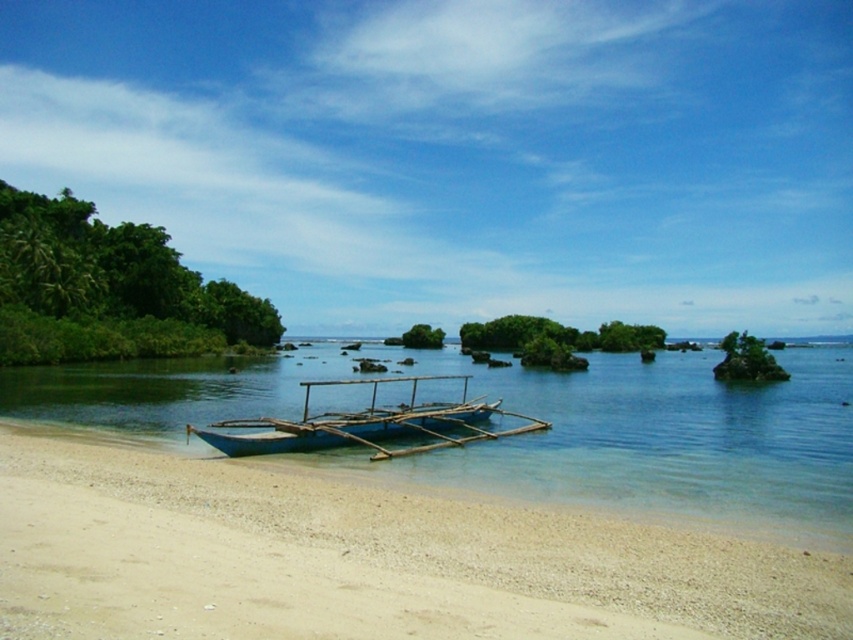
Is blue wooden water at center to the left of blue wooden boat at center from the viewer's perspective?

No, blue wooden water at center is not to the left of blue wooden boat at center.

Is blue wooden water at center above blue wooden boat at center?

No, blue wooden water at center is not above blue wooden boat at center.

Who is more forward, (492, 444) or (546, 420)?

Positioned in front is point (492, 444).

Locate an element on the screen. blue wooden water at center is located at coordinates (537, 433).

Can you confirm if white sandy beach at lower left is wider than blue wooden water at center?

No, white sandy beach at lower left is not wider than blue wooden water at center.

Find the location of a particular element. This screenshot has width=853, height=640. white sandy beach at lower left is located at coordinates (364, 561).

Is white sandy beach at lower left positioned in front of blue wooden boat at center?

Yes.

Between white sandy beach at lower left and blue wooden boat at center, which one appears on the left side from the viewer's perspective?

From the viewer's perspective, white sandy beach at lower left appears more on the left side.

In order to click on white sandy beach at lower left in this screenshot , I will do `click(364, 561)`.